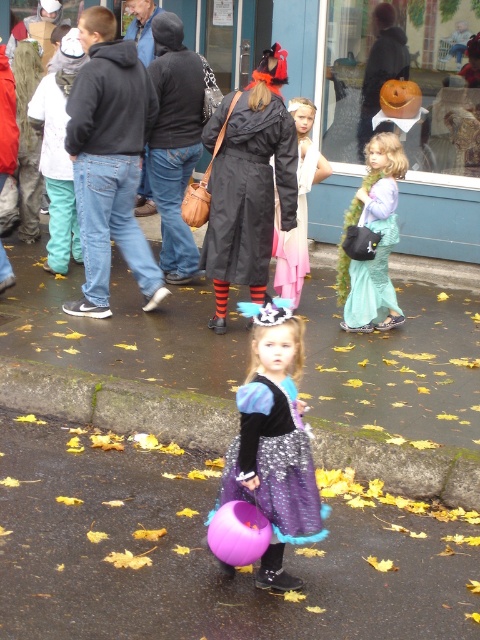
What is the position of the sparkly purple dress at center relative to the teal satin dress at right?

The sparkly purple dress at center is positioned to the left of the teal satin dress at right.

You are a photographer setting up for a Halloween event. You have two dresses to feature in the photoshoot, the sparkly purple dress at center and the teal satin dress at right. Based on their sizes, which dress should you focus on to ensure it fits well in a closeup shot without cropping?

The sparkly purple dress at center occupies less space than the teal satin dress at right, so focusing on the sparkly purple dress at center would allow it to fit better in a closeup shot without needing to crop.